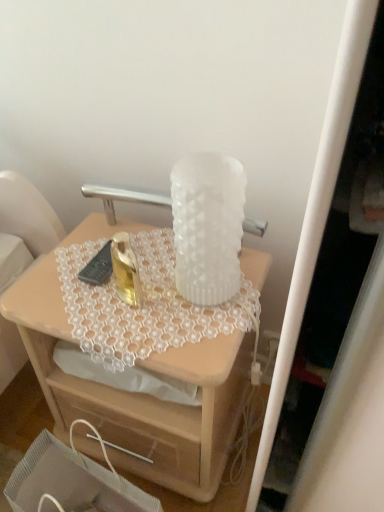
Question: Is white frosted vase at center to the right of translucent glass vase at upper center from the viewer's perspective?

Choices:
 (A) yes
 (B) no

Answer: (A)

Question: Is white frosted vase at center shorter than translucent glass vase at upper center?

Choices:
 (A) yes
 (B) no

Answer: (A)

Question: Are white frosted vase at center and translucent glass vase at upper center located far from each other?

Choices:
 (A) no
 (B) yes

Answer: (A)

Question: Is white frosted vase at center beside translucent glass vase at upper center?

Choices:
 (A) yes
 (B) no

Answer: (B)

Question: Is translucent glass vase at upper center a part of white frosted vase at center?

Choices:
 (A) yes
 (B) no

Answer: (B)

Question: In the image, is wooden drawer at lower center positioned in front of or behind translucent glass vase at upper center?

Choices:
 (A) front
 (B) behind

Answer: (A)

Question: Is point (134, 448) closer or farther from the camera than point (215, 404)?

Choices:
 (A) farther
 (B) closer

Answer: (A)

Question: In terms of size, does wooden drawer at lower center appear bigger or smaller than translucent glass vase at upper center?

Choices:
 (A) big
 (B) small

Answer: (B)

Question: From the image's perspective, is wooden drawer at lower center positioned above or below translucent glass vase at upper center?

Choices:
 (A) above
 (B) below

Answer: (B)

Question: From a real-world perspective, is white frosted vase at center physically located above or below wooden drawer at lower center?

Choices:
 (A) below
 (B) above

Answer: (B)

Question: From the image's perspective, is white frosted vase at center positioned above or below wooden drawer at lower center?

Choices:
 (A) below
 (B) above

Answer: (B)

Question: Is white frosted vase at center wider or thinner than wooden drawer at lower center?

Choices:
 (A) wide
 (B) thin

Answer: (B)

Question: Do you think white frosted vase at center is within wooden drawer at lower center, or outside of it?

Choices:
 (A) outside
 (B) inside

Answer: (A)

Question: From the image's perspective, relative to translucent glass vase at upper center, is white frosted vase at center above or below?

Choices:
 (A) above
 (B) below

Answer: (A)

Question: Is point (215, 241) closer or farther from the camera than point (213, 426)?

Choices:
 (A) closer
 (B) farther

Answer: (A)